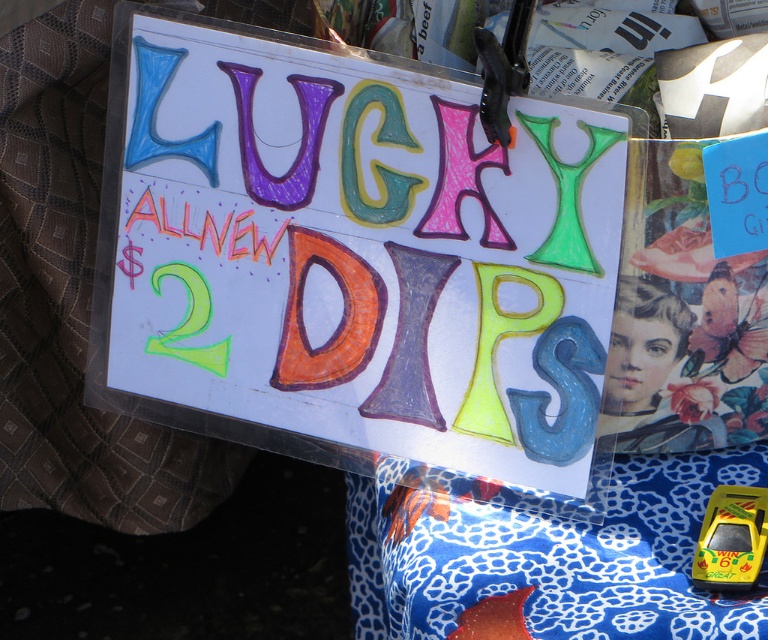
From the picture: You are standing in front of the signboard and want to touch the point at coordinates (351, 256). Is this point located on the hand drawn paper sign at center?

Yes, the point at coordinates (351, 256) is on the hand drawn paper sign at center.